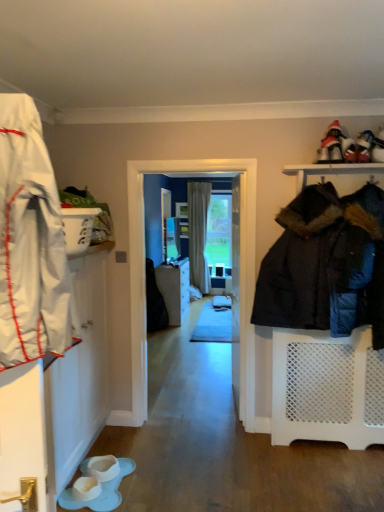
Question: Considering the positions of point (29, 346) and point (163, 284), is point (29, 346) closer or farther from the camera than point (163, 284)?

Choices:
 (A) closer
 (B) farther

Answer: (A)

Question: Relative to matte gray cabinet at center, is white fabric coat at left in front or behind?

Choices:
 (A) behind
 (B) front

Answer: (B)

Question: Considering the real-world distances, which object is farthest from the beige fabric curtain at center?

Choices:
 (A) white glossy door at center
 (B) white mesh shelf at right
 (C) white fabric coat at left
 (D) transparent glass screen door at center
 (E) white fabric shoe at upper right, arranged as the first footwear when viewed from the right

Answer: (C)

Question: Estimate the real-world distances between objects in this image. Which object is farther from the white glossy door at center?

Choices:
 (A) white rubber boot at lower center, the 2th footwear when ordered from top to bottom
 (B) transparent glass screen door at center
 (C) white mesh shelf at right
 (D) beige fabric curtain at center
 (E) white fabric coat at left

Answer: (D)